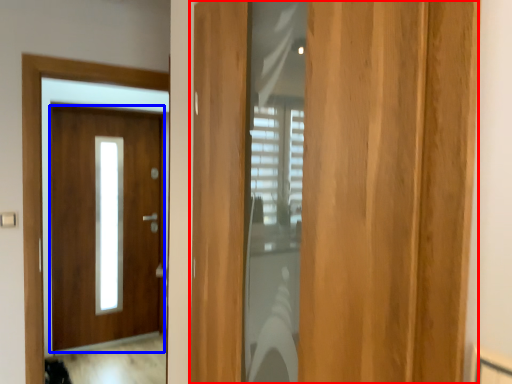
Question: Which point is closer to the camera, door (highlighted by a red box) or door (highlighted by a blue box)?

Choices:
 (A) door
 (B) door

Answer: (A)